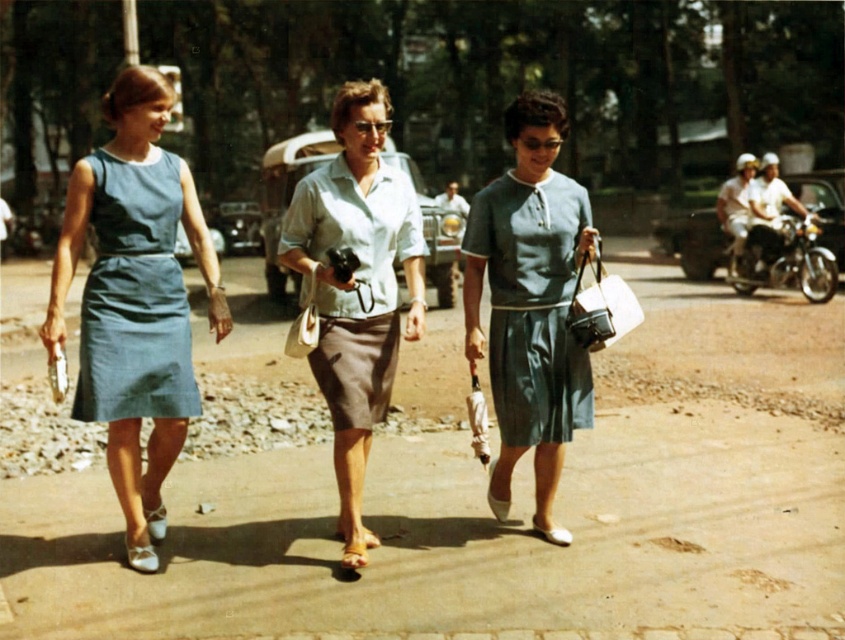
Question: Which point is closer to the camera?

Choices:
 (A) denim dress at left
 (B) shiny chrome motorcycle at right
 (C) light blue fabric blouse at center

Answer: (C)

Question: Which object is the closest to the matte green skirt at center?

Choices:
 (A) light blue fabric blouse at center
 (B) shiny chrome motorcycle at right

Answer: (A)

Question: Can you confirm if matte blue dress at left is positioned below shiny chrome motorcycle at right?

Choices:
 (A) no
 (B) yes

Answer: (B)

Question: Which of the following is the farthest from the observer?

Choices:
 (A) (128, 544)
 (B) (339, 352)
 (C) (191, 385)

Answer: (C)

Question: Can you confirm if matte green skirt at center is positioned below denim dress at left?

Choices:
 (A) yes
 (B) no

Answer: (A)

Question: Is light blue fabric blouse at center to the left of denim dress at left from the viewer's perspective?

Choices:
 (A) no
 (B) yes

Answer: (A)